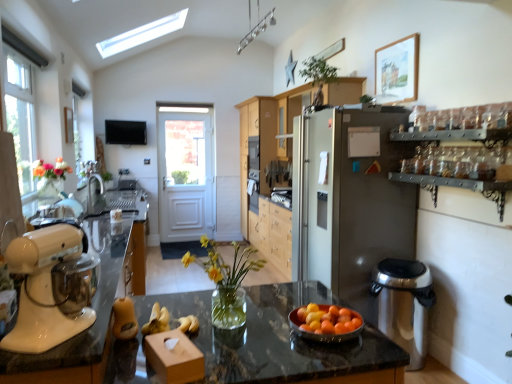
Identify the location of free space above orange matte bowl at center (from a real-world perspective). (324, 316).